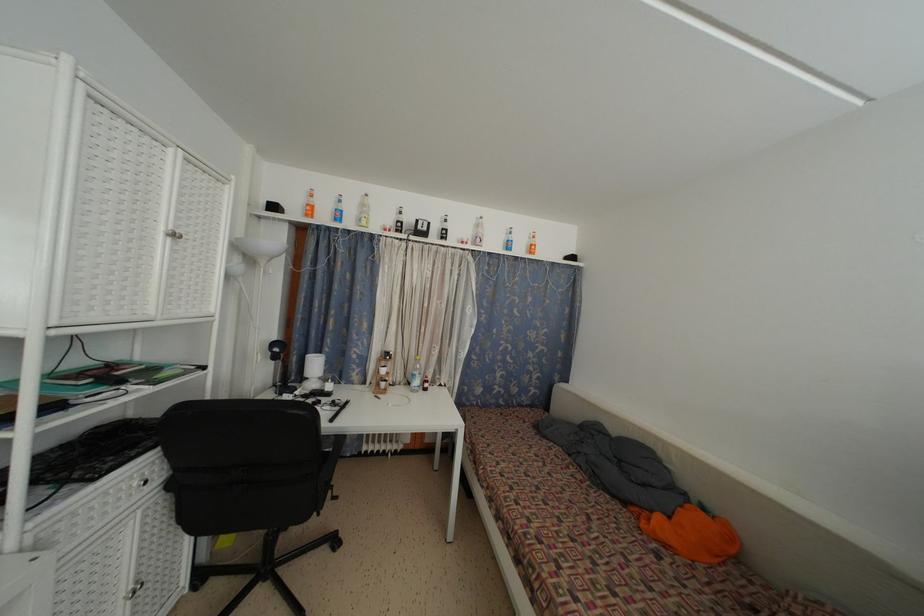
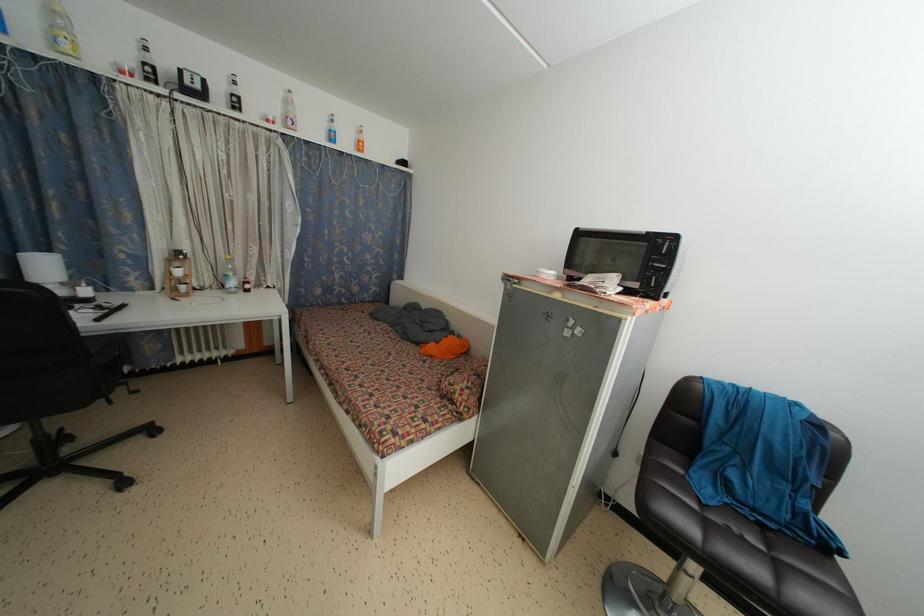
The point at (536, 251) is marked in the first image. Where is the corresponding point in the second image?

(362, 147)